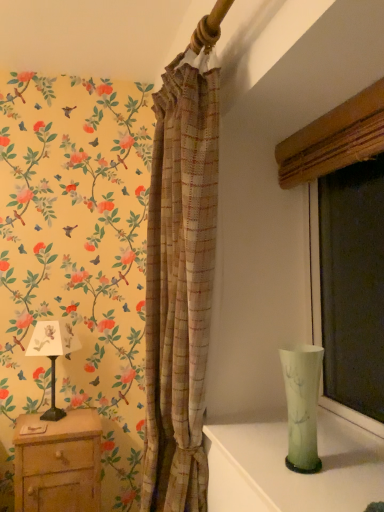
Where is `free location to the right of white paper lampshade at left`? free location to the right of white paper lampshade at left is located at coordinates (85, 423).